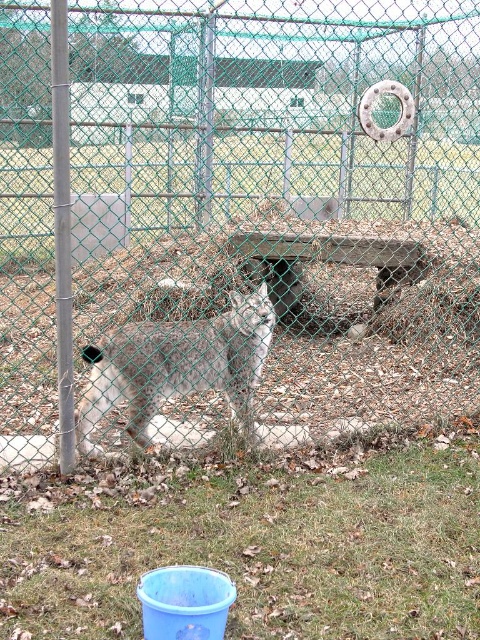
You are a zookeeper standing outside the enclosure. You need to place a new feeding tray on the opposite side of the green mesh fence at center from the fuzzy gray lynx at center. Where should you place the feeding tray?

The green mesh fence at center is to the left of the fuzzy gray lynx at center, so you should place the feeding tray to the right side of the green mesh fence at center to be opposite the lynx.